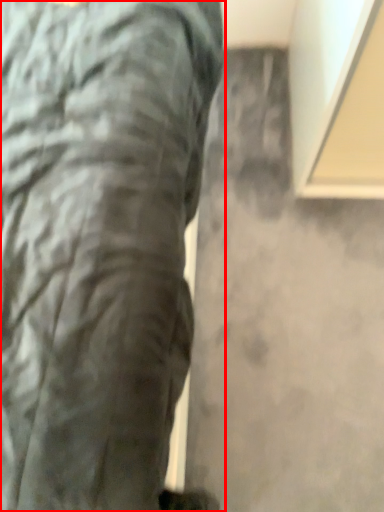
Question: Where is trousers (annotated by the red box) located in relation to concrete in the image?

Choices:
 (A) left
 (B) right

Answer: (A)